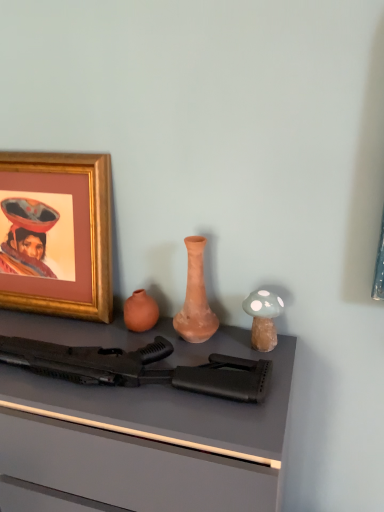
Question: Is matte clay vase at center surrounding gold-framed picture at upper left?

Choices:
 (A) no
 (B) yes

Answer: (A)

Question: Is matte clay vase at center outside gold-framed picture at upper left?

Choices:
 (A) yes
 (B) no

Answer: (A)

Question: Does matte clay vase at center have a lesser width compared to gold-framed picture at upper left?

Choices:
 (A) no
 (B) yes

Answer: (A)

Question: Is matte clay vase at center positioned with its back to gold-framed picture at upper left?

Choices:
 (A) no
 (B) yes

Answer: (A)

Question: Are matte clay vase at center and gold-framed picture at upper left far apart?

Choices:
 (A) no
 (B) yes

Answer: (A)

Question: Which is correct: black matte rifle at center is inside matte clay vase at center, or outside of it?

Choices:
 (A) outside
 (B) inside

Answer: (A)

Question: Based on their sizes in the image, would you say black matte rifle at center is bigger or smaller than matte clay vase at center?

Choices:
 (A) big
 (B) small

Answer: (A)

Question: Does point (127, 372) appear closer or farther from the camera than point (203, 330)?

Choices:
 (A) closer
 (B) farther

Answer: (A)

Question: From the image's perspective, relative to matte clay vase at center, is black matte rifle at center above or below?

Choices:
 (A) below
 (B) above

Answer: (A)

Question: From the image's perspective, is matte clay vase at center positioned above or below black matte rifle at center?

Choices:
 (A) above
 (B) below

Answer: (A)

Question: Looking at their shapes, would you say matte clay vase at center is wider or thinner than black matte rifle at center?

Choices:
 (A) wide
 (B) thin

Answer: (B)

Question: Considering their positions, is matte clay vase at center located in front of or behind black matte rifle at center?

Choices:
 (A) front
 (B) behind

Answer: (B)

Question: Considering the positions of matte clay vase at center and black matte rifle at center in the image, is matte clay vase at center bigger or smaller than black matte rifle at center?

Choices:
 (A) small
 (B) big

Answer: (A)

Question: From a real-world perspective, is gold-framed picture at upper left physically located above or below black matte rifle at center?

Choices:
 (A) above
 (B) below

Answer: (A)

Question: Considering the relative positions of gold-framed picture at upper left and black matte rifle at center in the image provided, is gold-framed picture at upper left to the left or to the right of black matte rifle at center?

Choices:
 (A) right
 (B) left

Answer: (B)